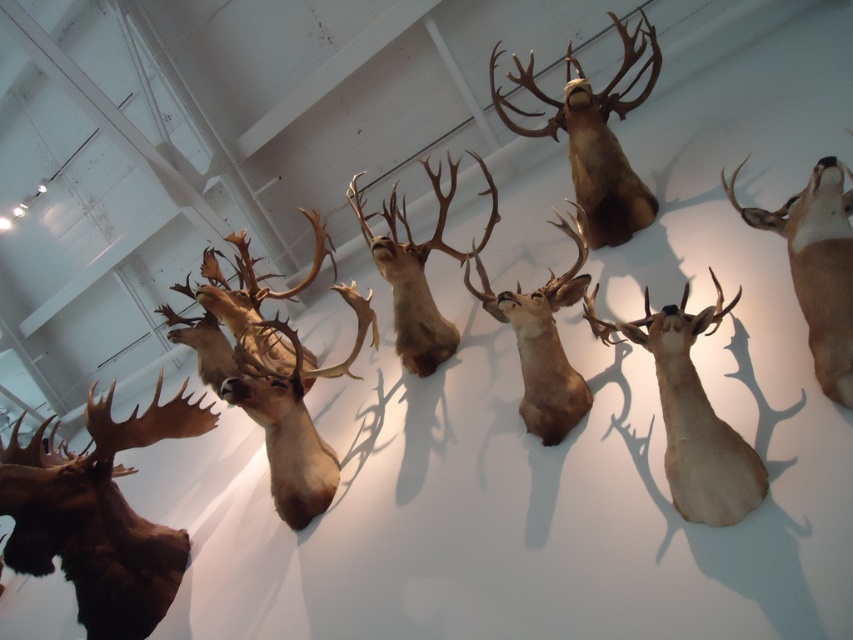
Can you confirm if brown matte/deer head at upper right is positioned below matte brown deer head at center?

Correct, brown matte/deer head at upper right is located below matte brown deer head at center.

Where is `brown matte/deer head at upper right`? Image resolution: width=853 pixels, height=640 pixels. brown matte/deer head at upper right is located at coordinates (817, 266).

This screenshot has width=853, height=640. Describe the element at coordinates (817, 266) in the screenshot. I see `brown matte/deer head at upper right` at that location.

I want to click on brown matte/deer head at upper right, so click(x=817, y=266).

Can you confirm if brown matte/deer head at upper right is positioned above brown matte/deer head at center?

Yes, brown matte/deer head at upper right is above brown matte/deer head at center.

Find the location of a particular element. brown matte/deer head at upper right is located at coordinates (817, 266).

Where is `brown matte/deer head at upper right`? Image resolution: width=853 pixels, height=640 pixels. brown matte/deer head at upper right is located at coordinates (817, 266).

Does brown matte/dead deer at lower left have a smaller size compared to brown matte/dead deer at upper center?

Correct, brown matte/dead deer at lower left occupies less space than brown matte/dead deer at upper center.

Which is above, brown matte/dead deer at lower left or brown matte/dead deer at upper center?

Positioned higher is brown matte/dead deer at upper center.

At what (x,y) coordinates should I click in order to perform the action: click on brown matte/dead deer at lower left. Please return your answer as a coordinate pair (x, y). This screenshot has width=853, height=640. Looking at the image, I should click on (102, 520).